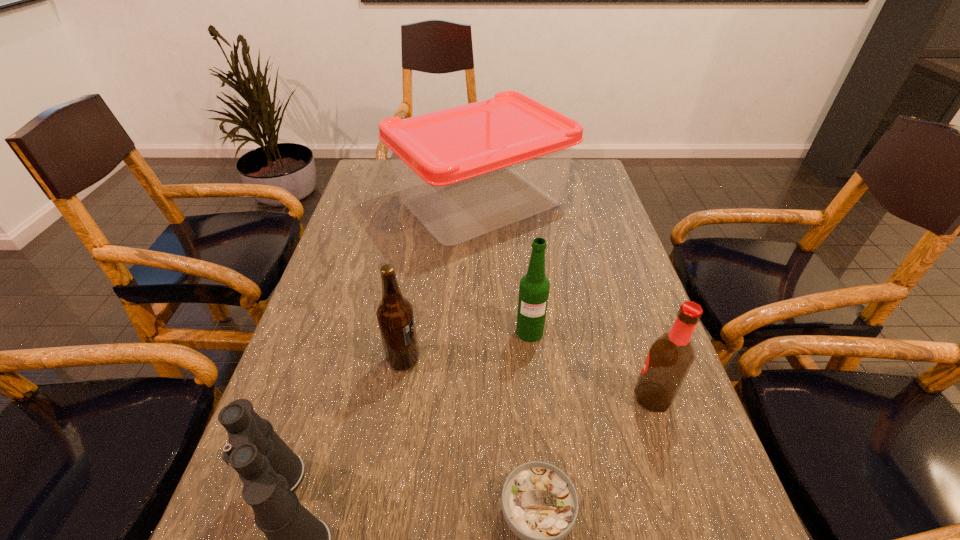
Where is `free location located 0.280m on the back of the rightmost beer bottle`? The width and height of the screenshot is (960, 540). free location located 0.280m on the back of the rightmost beer bottle is located at coordinates (615, 286).

Where is `object present at the far edge`? object present at the far edge is located at coordinates (465, 171).

I want to click on object present at the left edge, so click(465, 171).

Locate an element on the screen. The width and height of the screenshot is (960, 540). tray that is at the right edge is located at coordinates (465, 171).

Locate an element on the screen. The height and width of the screenshot is (540, 960). beer bottle present at the right edge is located at coordinates (670, 357).

This screenshot has height=540, width=960. I want to click on object present at the far left corner, so click(x=465, y=171).

Find the location of `object present at the far right corner`. object present at the far right corner is located at coordinates (465, 171).

Identify the location of blank area at the left edge. (346, 262).

You are a GUI agent. You are given a task and a screenshot of the screen. Output one action in this format:
    pyautogui.click(x=<x>, y=<y>)
    Task: Click on the vacant space at the right edge
    The image size is (960, 540).
    Given the screenshot: What is the action you would take?
    click(601, 294)

Locate an element on the screen. Image resolution: width=960 pixels, height=540 pixels. vacant space at the far left corner is located at coordinates (388, 176).